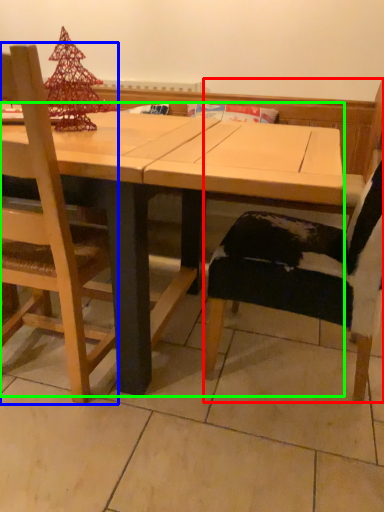
Question: Estimate the real-world distances between objects in this image. Which object is farther from chair (highlighted by a red box), chair (highlighted by a blue box) or table (highlighted by a green box)?

Choices:
 (A) chair
 (B) table

Answer: (A)